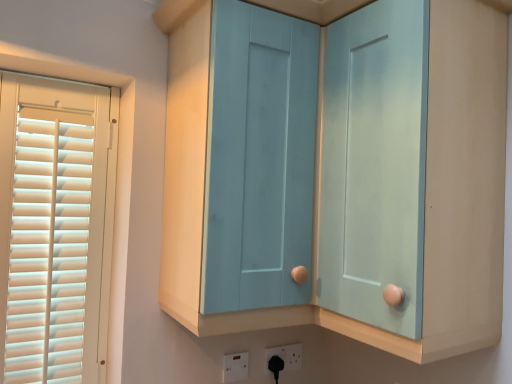
You are a GUI agent. You are given a task and a screenshot of the screen. Output one action in this format:
    pyautogui.click(x=<x>, y=<y>)
    Task: Click on the white plastic electric outlet at lower center, the 1th electric outlet when ordered from left to right
    The height and width of the screenshot is (384, 512).
    Given the screenshot: What is the action you would take?
    pyautogui.click(x=234, y=367)

What do you see at coordinates (234, 367) in the screenshot? I see `white plastic electric outlet at lower center, the 1th electric outlet when ordered from left to right` at bounding box center [234, 367].

Find the location of a particular element. Image resolution: width=512 pixels, height=384 pixels. matte blue cabinet at center is located at coordinates (258, 158).

Where is `light blue wood cabinet at center`? light blue wood cabinet at center is located at coordinates 319,186.

Describe the element at coordinates (319, 186) in the screenshot. I see `light blue wood cabinet at center` at that location.

In order to click on white plastic electric outlet at lower center, acting as the first electric outlet starting from the front in this screenshot , I will do `click(234, 367)`.

Would you consider white plastic electric outlet at lower center, the 2th electric outlet positioned from the back, to be distant from matte blue cabinet at center?

Actually, white plastic electric outlet at lower center, the 2th electric outlet positioned from the back, and matte blue cabinet at center are a little close together.

Does point (244, 375) come farther from viewer compared to point (230, 174)?

Yes, it is.

Is white plastic electric outlet at lower center, arranged as the 2th electric outlet when viewed from the right, surrounding matte blue cabinet at center?

No, matte blue cabinet at center is not a part of white plastic electric outlet at lower center, arranged as the 2th electric outlet when viewed from the right.

From the image's perspective, which is below, white plastic electric outlet at lower center, acting as the first electric outlet starting from the front, or matte blue cabinet at center?

white plastic electric outlet at lower center, acting as the first electric outlet starting from the front, appears lower in the image.

Considering the positions of point (301, 140) and point (234, 380), is point (301, 140) closer or farther from the camera than point (234, 380)?

Point (301, 140) is positioned closer to the camera compared to point (234, 380).

Can you tell me how much matte blue cabinet at center and white plastic electric outlet at lower center, arranged as the 2th electric outlet when viewed from the right, differ in facing direction?

matte blue cabinet at center and white plastic electric outlet at lower center, arranged as the 2th electric outlet when viewed from the right, are facing 4.93 degrees away from each other.

From a real-world perspective, relative to white plastic electric outlet at lower center, the 2th electric outlet positioned from the back, is matte blue cabinet at center vertically above or below?

In terms of real-world spatial position, matte blue cabinet at center is above white plastic electric outlet at lower center, the 2th electric outlet positioned from the back.

Between point (301, 355) and point (243, 365), which one is positioned behind?

The point (301, 355) is more distant.

Would you say white plastic socket at lower center, positioned as the 2th electric outlet in front-to-back order, is outside white plastic electric outlet at lower center, acting as the first electric outlet starting from the front?

That's correct, white plastic socket at lower center, positioned as the 2th electric outlet in front-to-back order, is outside of white plastic electric outlet at lower center, acting as the first electric outlet starting from the front.

Is white plastic socket at lower center, positioned as the 2th electric outlet in front-to-back order, at the left side of white plastic electric outlet at lower center, arranged as the 2th electric outlet when viewed from the right?

In fact, white plastic socket at lower center, positioned as the 2th electric outlet in front-to-back order, is to the right of white plastic electric outlet at lower center, arranged as the 2th electric outlet when viewed from the right.

Which of these two, white plastic socket at lower center, acting as the 1th electric outlet starting from the back, or white plastic electric outlet at lower center, the 1th electric outlet when ordered from left to right, is wider?

white plastic electric outlet at lower center, the 1th electric outlet when ordered from left to right.

Which point is more distant from viewer, (475, 207) or (278, 277)?

The point (278, 277) is more distant.

Considering the relative sizes of light blue wood cabinet at center and matte blue cabinet at center in the image provided, is light blue wood cabinet at center bigger than matte blue cabinet at center?

Indeed, light blue wood cabinet at center has a larger size compared to matte blue cabinet at center.

Is light blue wood cabinet at center looking in the opposite direction of matte blue cabinet at center?

Yes, light blue wood cabinet at center is positioned with its back facing matte blue cabinet at center.

Is matte blue cabinet at center inside light blue wood cabinet at center?

Indeed, matte blue cabinet at center is located within light blue wood cabinet at center.

Is white plastic socket at lower center, positioned as the 2th electric outlet in front-to-back order, situated inside light blue wood cabinet at center or outside?

white plastic socket at lower center, positioned as the 2th electric outlet in front-to-back order, lies outside light blue wood cabinet at center.

Is white plastic socket at lower center, the 2th electric outlet from the left, smaller than light blue wood cabinet at center?

Indeed, white plastic socket at lower center, the 2th electric outlet from the left, has a smaller size compared to light blue wood cabinet at center.

Which point is more forward, [291,355] or [200,10]?

Positioned in front is point [200,10].

Is matte blue cabinet at center beside white plastic socket at lower center, acting as the 1th electric outlet starting from the back?

No, matte blue cabinet at center is not touching white plastic socket at lower center, acting as the 1th electric outlet starting from the back.

Is the depth of matte blue cabinet at center less than that of white plastic socket at lower center, positioned as the 2th electric outlet in front-to-back order?

That is True.

Considering the sizes of objects matte blue cabinet at center and white plastic socket at lower center, acting as the first electric outlet starting from the right, in the image provided, who is taller, matte blue cabinet at center or white plastic socket at lower center, acting as the first electric outlet starting from the right,?

With more height is matte blue cabinet at center.

From a real-world perspective, is light blue wood cabinet at center below white plastic electric outlet at lower center, the 1th electric outlet when ordered from left to right?

No.

In the image, is light blue wood cabinet at center positioned in front of or behind white plastic electric outlet at lower center, arranged as the 2th electric outlet when viewed from the right?

light blue wood cabinet at center is in front of white plastic electric outlet at lower center, arranged as the 2th electric outlet when viewed from the right.

Between light blue wood cabinet at center and white plastic electric outlet at lower center, acting as the first electric outlet starting from the front, which one has larger width?

light blue wood cabinet at center.

Can we say light blue wood cabinet at center lies outside white plastic electric outlet at lower center, the 2th electric outlet positioned from the back?

Yes, light blue wood cabinet at center is located beyond the bounds of white plastic electric outlet at lower center, the 2th electric outlet positioned from the back.

The width and height of the screenshot is (512, 384). There is a matte blue cabinet at center. Find the location of `the 1st electric outlet below it (from a real-world perspective)`. the 1st electric outlet below it (from a real-world perspective) is located at coordinates (234, 367).

The width and height of the screenshot is (512, 384). I want to click on the 1st electric outlet to the right when counting from the matte blue cabinet at center, so click(234, 367).

Looking at the image, which one is located further to white plastic electric outlet at lower center, arranged as the 2th electric outlet when viewed from the right, matte blue cabinet at center or white plastic socket at lower center, acting as the 1th electric outlet starting from the back?

The object further to white plastic electric outlet at lower center, arranged as the 2th electric outlet when viewed from the right, is matte blue cabinet at center.

Considering their positions, is matte blue cabinet at center positioned closer to light blue wood cabinet at center than white plastic electric outlet at lower center, arranged as the 2th electric outlet when viewed from the right?

matte blue cabinet at center is closer to light blue wood cabinet at center.

Based on their spatial positions, is matte blue cabinet at center or white plastic socket at lower center, acting as the first electric outlet starting from the right, closer to light blue wood cabinet at center?

matte blue cabinet at center is positioned closer to the anchor light blue wood cabinet at center.

Looking at the image, which one is located further to matte blue cabinet at center, white plastic socket at lower center, acting as the first electric outlet starting from the right, or white plastic electric outlet at lower center, the 1th electric outlet when ordered from left to right?

Based on the image, white plastic socket at lower center, acting as the first electric outlet starting from the right, appears to be further to matte blue cabinet at center.

Based on their spatial positions, is matte blue cabinet at center or light blue wood cabinet at center closer to white plastic electric outlet at lower center, arranged as the 2th electric outlet when viewed from the right?

matte blue cabinet at center is positioned closer to the anchor white plastic electric outlet at lower center, arranged as the 2th electric outlet when viewed from the right.

In the scene shown: From the image, which object appears to be nearer to white plastic electric outlet at lower center, the 1th electric outlet when ordered from left to right, light blue wood cabinet at center or white plastic socket at lower center, acting as the 1th electric outlet starting from the back?

The object closer to white plastic electric outlet at lower center, the 1th electric outlet when ordered from left to right, is white plastic socket at lower center, acting as the 1th electric outlet starting from the back.

When comparing their distances from white plastic socket at lower center, acting as the 1th electric outlet starting from the back, does white plastic electric outlet at lower center, the 2th electric outlet positioned from the back, or light blue wood cabinet at center seem further?

light blue wood cabinet at center is further to white plastic socket at lower center, acting as the 1th electric outlet starting from the back.

When comparing their distances from matte blue cabinet at center, does white plastic electric outlet at lower center, arranged as the 2th electric outlet when viewed from the right, or white plastic socket at lower center, positioned as the 2th electric outlet in front-to-back order, seem further?

The object further to matte blue cabinet at center is white plastic socket at lower center, positioned as the 2th electric outlet in front-to-back order.

Where is `screen door positioned between light blue wood cabinet at center and white plastic electric outlet at lower center, acting as the first electric outlet starting from the front, from near to far`? Image resolution: width=512 pixels, height=384 pixels. screen door positioned between light blue wood cabinet at center and white plastic electric outlet at lower center, acting as the first electric outlet starting from the front, from near to far is located at coordinates (258, 158).

Locate an element on the screen. electric outlet between matte blue cabinet at center and white plastic socket at lower center, positioned as the 2th electric outlet in front-to-back order, in the up-down direction is located at coordinates (234, 367).

At what (x,y) coordinates should I click in order to perform the action: click on electric outlet between light blue wood cabinet at center and white plastic socket at lower center, acting as the 1th electric outlet starting from the back, from front to back. Please return your answer as a coordinate pair (x, y). The image size is (512, 384). Looking at the image, I should click on (234, 367).

The image size is (512, 384). Find the location of `screen door between light blue wood cabinet at center and white plastic socket at lower center, acting as the 1th electric outlet starting from the back, from front to back`. screen door between light blue wood cabinet at center and white plastic socket at lower center, acting as the 1th electric outlet starting from the back, from front to back is located at coordinates (258, 158).